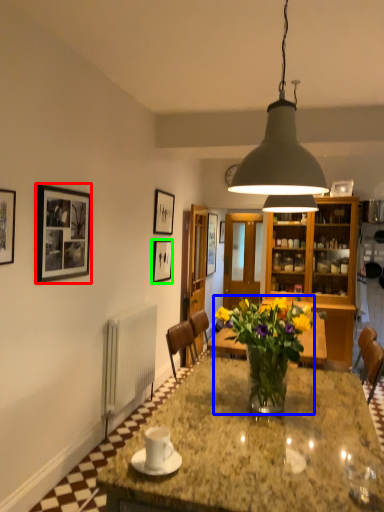
Question: Which is farther away from picture frame (highlighted by a red box)? houseplant (highlighted by a blue box) or picture frame (highlighted by a green box)?

Choices:
 (A) houseplant
 (B) picture frame

Answer: (B)